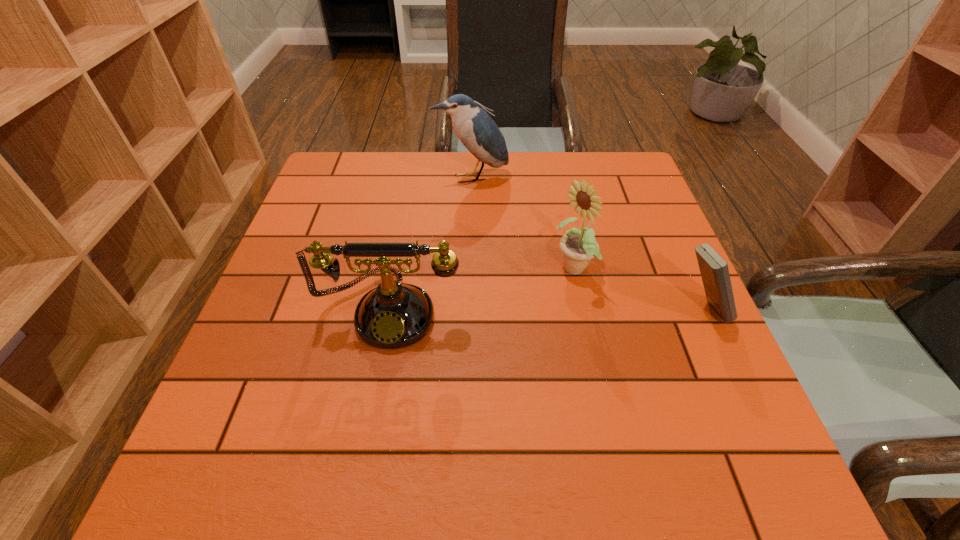
Find the location of a particular element. the second shortest object is located at coordinates (394, 315).

This screenshot has height=540, width=960. Identify the location of the rightmost object. (714, 270).

Find the location of a particular element. This screenshot has width=960, height=540. the shortest object is located at coordinates (714, 270).

Where is `the third object from left to right`? This screenshot has width=960, height=540. the third object from left to right is located at coordinates (578, 246).

The image size is (960, 540). Identify the location of bird. (478, 132).

At what (x,y) coordinates should I click in order to perform the action: click on vacant space located on the dial of the third tallest object. Please return your answer as a coordinate pair (x, y). Looking at the image, I should click on (373, 408).

The width and height of the screenshot is (960, 540). I want to click on blank space located 0.180m on the front-facing side of the sunflower, so click(493, 321).

This screenshot has width=960, height=540. Identify the location of free region located 0.400m on the front-facing side of the sunflower. (398, 376).

Where is `free space located 0.330m on the front-facing side of the sunflower`? Image resolution: width=960 pixels, height=540 pixels. free space located 0.330m on the front-facing side of the sunflower is located at coordinates (431, 357).

At what (x,y) coordinates should I click in order to perform the action: click on vacant region located at the tip of the bird's beak. Please return your answer as a coordinate pair (x, y). Looking at the image, I should click on (513, 269).